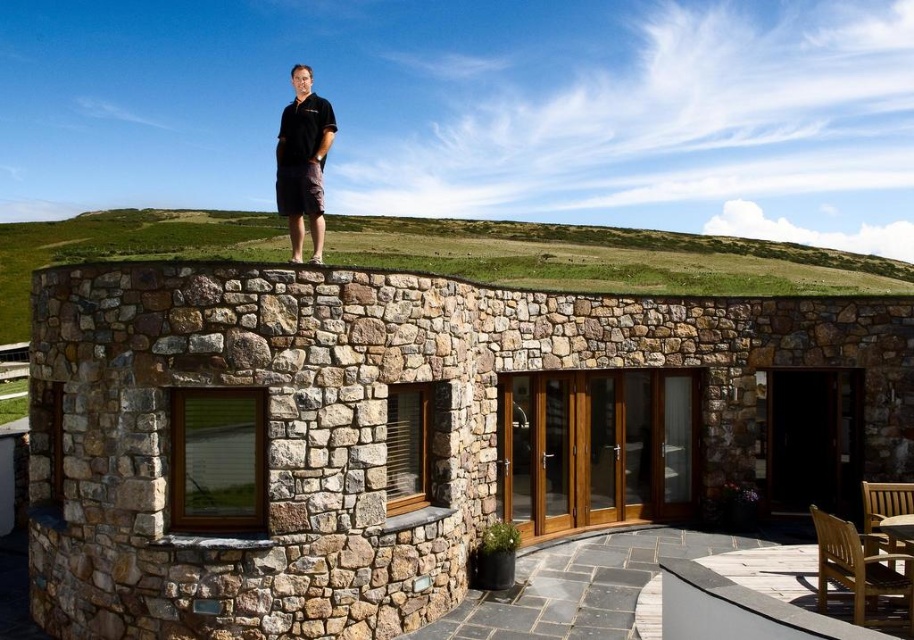
You are standing on the paved patio and looking towards the house. Which object, the natural stone wall at upper center or the white concrete ledge at lower right, is located higher in the scene?

The natural stone wall at upper center is located higher because it is positioned over the white concrete ledge at lower right.